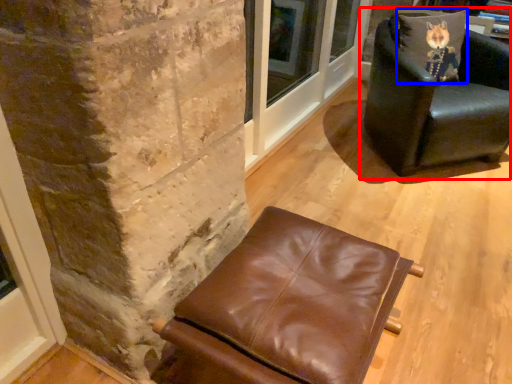
Question: Among these objects, which one is farthest to the camera, chair (highlighted by a red box) or pillow (highlighted by a blue box)?

Choices:
 (A) chair
 (B) pillow

Answer: (B)